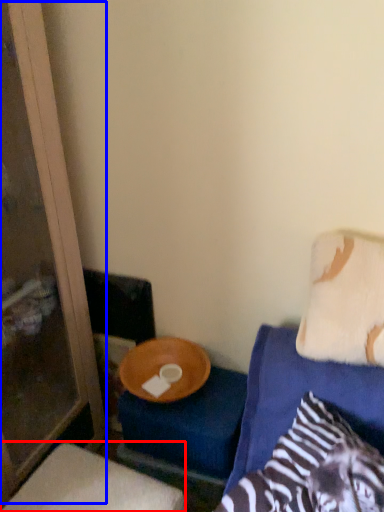
Question: Which point is further to the camera, furniture (highlighted by a red box) or screen door (highlighted by a blue box)?

Choices:
 (A) furniture
 (B) screen door

Answer: (A)